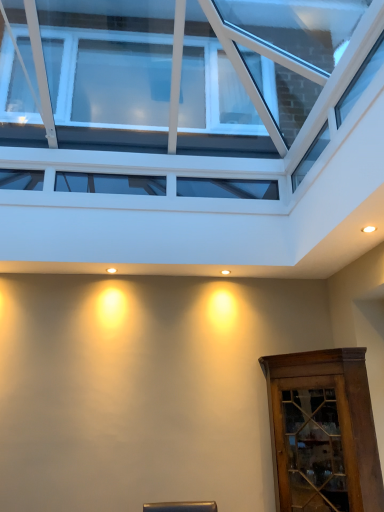
Question: Choose the correct answer: Is transparent glass window at upper center inside brown wooden cabinet at lower right or outside it?

Choices:
 (A) outside
 (B) inside

Answer: (A)

Question: From a real-world perspective, is transparent glass window at upper center above or below brown wooden cabinet at lower right?

Choices:
 (A) below
 (B) above

Answer: (B)

Question: Considering the positions of transparent glass window at upper center and brown wooden cabinet at lower right in the image, is transparent glass window at upper center taller or shorter than brown wooden cabinet at lower right?

Choices:
 (A) short
 (B) tall

Answer: (B)

Question: Is brown wooden cabinet at lower right taller or shorter than transparent glass window at upper center?

Choices:
 (A) tall
 (B) short

Answer: (B)

Question: Would you say brown wooden cabinet at lower right is inside or outside transparent glass window at upper center?

Choices:
 (A) outside
 (B) inside

Answer: (A)

Question: From the image's perspective, is brown wooden cabinet at lower right located above or below transparent glass window at upper center?

Choices:
 (A) above
 (B) below

Answer: (B)

Question: From a real-world perspective, is brown wooden cabinet at lower right above or below transparent glass window at upper center?

Choices:
 (A) below
 (B) above

Answer: (A)